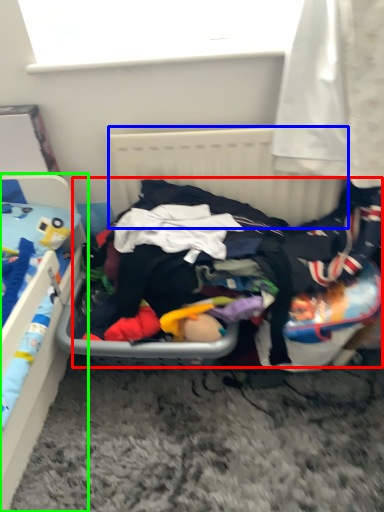
Question: Based on their relative distances, which object is nearer to clothing (highlighted by a red box)? Choose from radiator (highlighted by a blue box) and furniture (highlighted by a green box).

Choices:
 (A) radiator
 (B) furniture

Answer: (A)